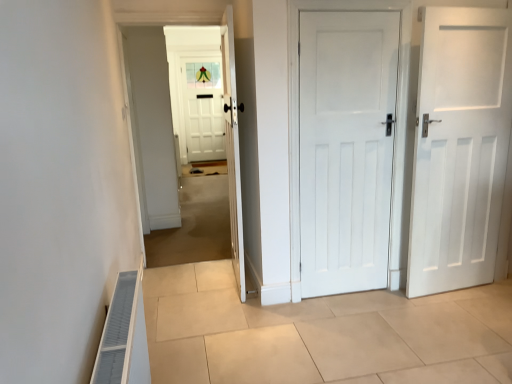
You are a GUI agent. You are given a task and a screenshot of the screen. Output one action in this format:
    pyautogui.click(x=<x>, y=<y>)
    Task: Click on the free space to the left of white wooden door at center, placed as the first door when sorted from left to right
    Image resolution: width=512 pixels, height=384 pixels.
    Given the screenshot: What is the action you would take?
    pyautogui.click(x=192, y=281)